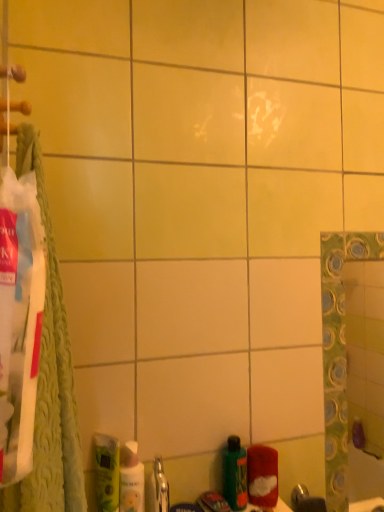
Question: Considering the relative sizes of green matte bottle at lower center and white glossy mouthwash at lower left, which is the second mouthwash from left to right, in the image provided, is green matte bottle at lower center bigger than white glossy mouthwash at lower left, which is the second mouthwash from left to right,?

Choices:
 (A) yes
 (B) no

Answer: (A)

Question: Is green matte bottle at lower center oriented away from white glossy mouthwash at lower left, which ranks as the first mouthwash in right-to-left order?

Choices:
 (A) yes
 (B) no

Answer: (B)

Question: From the image's perspective, is green matte bottle at lower center under white glossy mouthwash at lower left, which is the second mouthwash from left to right?

Choices:
 (A) no
 (B) yes

Answer: (B)

Question: Would you say white glossy mouthwash at lower left, which is the second mouthwash from left to right, is part of green matte bottle at lower center's contents?

Choices:
 (A) yes
 (B) no

Answer: (B)

Question: From a real-world perspective, does green matte bottle at lower center sit lower than white glossy mouthwash at lower left, which is the second mouthwash from left to right?

Choices:
 (A) no
 (B) yes

Answer: (B)

Question: Looking at the image, does green matte mouthwash at lower left, the 2th mouthwash positioned from the right, seem bigger or smaller compared to green textured towel at left?

Choices:
 (A) small
 (B) big

Answer: (A)

Question: Considering their positions, is green matte mouthwash at lower left, the 2th mouthwash positioned from the right, located in front of or behind green textured towel at left?

Choices:
 (A) front
 (B) behind

Answer: (B)

Question: In terms of height, does green matte mouthwash at lower left, which is the first mouthwash from left to right, look taller or shorter compared to green textured towel at left?

Choices:
 (A) tall
 (B) short

Answer: (B)

Question: Based on their positions, is green matte mouthwash at lower left, the 2th mouthwash positioned from the right, located to the left or right of green textured towel at left?

Choices:
 (A) right
 (B) left

Answer: (A)

Question: Is white glossy mouthwash at lower left, which is the second mouthwash from left to right, in front of or behind green textured towel at left in the image?

Choices:
 (A) front
 (B) behind

Answer: (B)

Question: In the image, is white glossy mouthwash at lower left, which is the second mouthwash from left to right, on the left side or the right side of green textured towel at left?

Choices:
 (A) left
 (B) right

Answer: (B)

Question: Does point (137, 509) appear closer or farther from the camera than point (61, 345)?

Choices:
 (A) farther
 (B) closer

Answer: (A)

Question: From a real-world perspective, relative to green textured towel at left, is white glossy mouthwash at lower left, which is the second mouthwash from left to right, vertically above or below?

Choices:
 (A) below
 (B) above

Answer: (A)

Question: From the image's perspective, is green matte mouthwash at lower left, which is the first mouthwash from left to right, above or below red fuzzy cloth at lower right?

Choices:
 (A) above
 (B) below

Answer: (A)

Question: Considering the positions of green matte mouthwash at lower left, the 2th mouthwash positioned from the right, and red fuzzy cloth at lower right in the image, is green matte mouthwash at lower left, the 2th mouthwash positioned from the right, wider or thinner than red fuzzy cloth at lower right?

Choices:
 (A) wide
 (B) thin

Answer: (B)